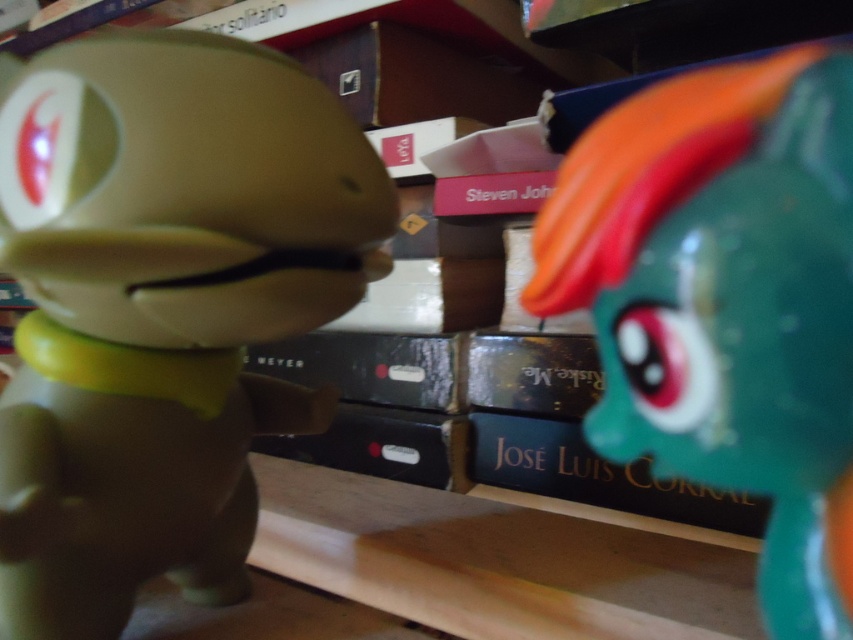
You are a collector who wants to display the matte green toy at left and the gold textured book at center on a shelf. Given that the shelf has a height limit of 12 inches, can both items be placed without exceeding the height limit?

The matte green toy at left is much taller than the gold textured book at center. If the shelf has a height limit of 12 inches, you need to ensure the tallest item, the matte green toy at left, does not exceed this limit. If it is under 12 inches, both can fit. However, if the toy exceeds 12 inches, it will not fit.

You are a collector organizing a shelf. You have a matte green toy at left and a gold textured book at center. Which object is placed higher up on the shelf?

The matte green toy at left is positioned over the gold textured book at center, so it is placed higher up on the shelf.